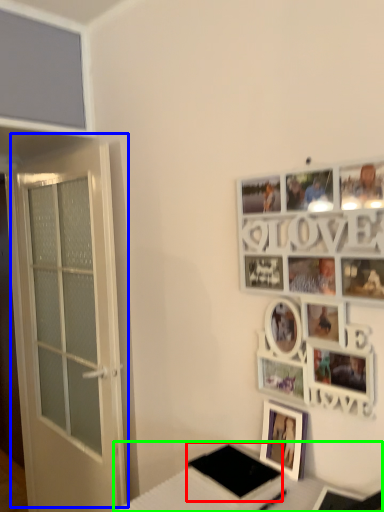
Question: Estimate the real-world distances between objects in this image. Which object is farther from pad (highlighted by a red box), door (highlighted by a blue box) or table (highlighted by a green box)?

Choices:
 (A) door
 (B) table

Answer: (A)